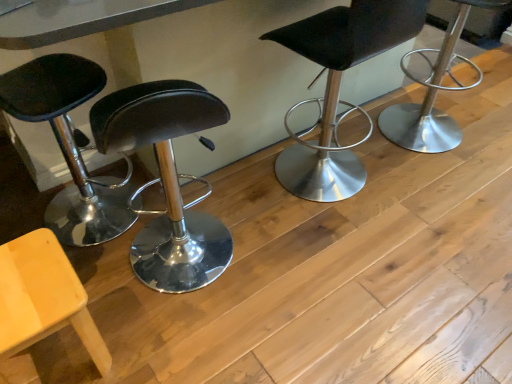
At what (x,y) coordinates should I click in order to perform the action: click on matte black stool at left, arranged as the fourth chair when viewed from the right. Please return your answer as a coordinate pair (x, y). Looking at the image, I should click on (69, 145).

What do you see at coordinates (42, 297) in the screenshot? I see `matte yellow chair at lower left, which ranks as the third chair in right-to-left order` at bounding box center [42, 297].

In order to click on polished silver stool at right, the 4th chair in the left-to-right sequence in this screenshot , I will do `click(433, 94)`.

From the picture: In order to face black leather stool at center, the 3th chair in the left-to-right sequence, should I rotate leftwards or rightwards?

Rotate right and turn 10.837 degrees.

Identify the location of matte black stool at left, arranged as the fourth chair when viewed from the right. The height and width of the screenshot is (384, 512). (69, 145).

Considering the positions of objects polished silver stool at right, the first chair positioned from the right, and matte black stool at left, arranged as the fourth chair when viewed from the right, in the image provided, who is in front, polished silver stool at right, the first chair positioned from the right, or matte black stool at left, arranged as the fourth chair when viewed from the right,?

Positioned in front is matte black stool at left, arranged as the fourth chair when viewed from the right.

Is polished silver stool at right, the 4th chair in the left-to-right sequence, positioned beyond the bounds of matte black stool at left, which appears as the 1th chair when viewed from the left?

Absolutely, polished silver stool at right, the 4th chair in the left-to-right sequence, is external to matte black stool at left, which appears as the 1th chair when viewed from the left.

This screenshot has height=384, width=512. I want to click on the 2nd chair above the matte black stool at left, arranged as the fourth chair when viewed from the right (from the image's perspective), so click(x=433, y=94).

Based on the photo, is matte black stool at left, arranged as the fourth chair when viewed from the right, at the back of polished silver stool at right, the first chair positioned from the right?

No, polished silver stool at right, the first chair positioned from the right,'s orientation is not away from matte black stool at left, arranged as the fourth chair when viewed from the right.

How many degrees apart are the facing directions of black leather stool at center, positioned as the 2th chair in right-to-left order, and matte black stool at left, arranged as the fourth chair when viewed from the right?

The angle between the facing direction of black leather stool at center, positioned as the 2th chair in right-to-left order, and the facing direction of matte black stool at left, arranged as the fourth chair when viewed from the right, is 96.2 degrees.

Could you tell me if black leather stool at center, the 3th chair in the left-to-right sequence, is facing matte black stool at left, which appears as the 1th chair when viewed from the left?

No, black leather stool at center, the 3th chair in the left-to-right sequence, is not facing towards matte black stool at left, which appears as the 1th chair when viewed from the left.

Is black leather stool at center, positioned as the 2th chair in right-to-left order, to the left of matte black stool at left, which appears as the 1th chair when viewed from the left, from the viewer's perspective?

Incorrect, black leather stool at center, positioned as the 2th chair in right-to-left order, is not on the left side of matte black stool at left, which appears as the 1th chair when viewed from the left.

Is black leather stool at center, the 3th chair in the left-to-right sequence, next to matte black stool at left, which appears as the 1th chair when viewed from the left, and touching it?

No, black leather stool at center, the 3th chair in the left-to-right sequence, is not making contact with matte black stool at left, which appears as the 1th chair when viewed from the left.

Who is smaller, black leather stool at center, the 3th chair in the left-to-right sequence, or matte yellow chair at lower left, which ranks as the third chair in right-to-left order?

With smaller size is matte yellow chair at lower left, which ranks as the third chair in right-to-left order.

Starting from the black leather stool at center, positioned as the 2th chair in right-to-left order, which chair is the 1st one to the left? Please provide its 2D coordinates.

[(42, 297)]

Between point (347, 51) and point (109, 367), which one is positioned behind?

The point (347, 51) is farther.

Based on the photo, from a real-world perspective, is black leather stool at center, the 3th chair in the left-to-right sequence, on top of matte yellow chair at lower left, which ranks as the third chair in right-to-left order?

Yes, from a real-world perspective, black leather stool at center, the 3th chair in the left-to-right sequence, is over matte yellow chair at lower left, which ranks as the third chair in right-to-left order

Is polished silver stool at right, the first chair positioned from the right, facing towards matte yellow chair at lower left, which ranks as the third chair in right-to-left order?

No, polished silver stool at right, the first chair positioned from the right, is not oriented towards matte yellow chair at lower left, which ranks as the third chair in right-to-left order.

Between point (428, 96) and point (86, 324), which one is positioned behind?

The point (428, 96) is more distant.

Is polished silver stool at right, the 4th chair in the left-to-right sequence, far away from matte yellow chair at lower left, which ranks as the third chair in right-to-left order?

Indeed, polished silver stool at right, the 4th chair in the left-to-right sequence, is not near matte yellow chair at lower left, which ranks as the third chair in right-to-left order.

Can you confirm if polished silver stool at right, the 4th chair in the left-to-right sequence, is smaller than matte yellow chair at lower left, the 2th chair in the left-to-right sequence?

No, polished silver stool at right, the 4th chair in the left-to-right sequence, is not smaller than matte yellow chair at lower left, the 2th chair in the left-to-right sequence.

Where is `the 2nd chair in front of the black leather stool at center, positioned as the 2th chair in right-to-left order`? the 2nd chair in front of the black leather stool at center, positioned as the 2th chair in right-to-left order is located at coordinates (42, 297).

Is matte yellow chair at lower left, the 2th chair in the left-to-right sequence, inside or outside of black leather stool at center, positioned as the 2th chair in right-to-left order?

matte yellow chair at lower left, the 2th chair in the left-to-right sequence, is outside black leather stool at center, positioned as the 2th chair in right-to-left order.

Based on their sizes in the image, would you say matte yellow chair at lower left, which ranks as the third chair in right-to-left order, is bigger or smaller than black leather stool at center, positioned as the 2th chair in right-to-left order?

In the image, matte yellow chair at lower left, which ranks as the third chair in right-to-left order, appears to be smaller than black leather stool at center, positioned as the 2th chair in right-to-left order.

Is matte yellow chair at lower left, which ranks as the third chair in right-to-left order, beside matte black stool at left, which appears as the 1th chair when viewed from the left?

matte yellow chair at lower left, which ranks as the third chair in right-to-left order, and matte black stool at left, which appears as the 1th chair when viewed from the left, are not in contact.

Image resolution: width=512 pixels, height=384 pixels. I want to click on chair below the matte black stool at left, arranged as the fourth chair when viewed from the right (from a real-world perspective), so click(42, 297).

From the image's perspective, is matte yellow chair at lower left, the 2th chair in the left-to-right sequence, located above or below matte black stool at left, which appears as the 1th chair when viewed from the left?

matte yellow chair at lower left, the 2th chair in the left-to-right sequence, is below matte black stool at left, which appears as the 1th chair when viewed from the left.

Which of these two, matte yellow chair at lower left, which ranks as the third chair in right-to-left order, or matte black stool at left, which appears as the 1th chair when viewed from the left, stands taller?

With more height is matte black stool at left, which appears as the 1th chair when viewed from the left.

Considering the relative sizes of polished silver stool at right, the 4th chair in the left-to-right sequence, and black leather stool at center, the 3th chair in the left-to-right sequence, in the image provided, is polished silver stool at right, the 4th chair in the left-to-right sequence, thinner than black leather stool at center, the 3th chair in the left-to-right sequence,?

Incorrect, the width of polished silver stool at right, the 4th chair in the left-to-right sequence, is not less than that of black leather stool at center, the 3th chair in the left-to-right sequence.

Is polished silver stool at right, the first chair positioned from the right, turned away from black leather stool at center, the 3th chair in the left-to-right sequence?

polished silver stool at right, the first chair positioned from the right, is not turned away from black leather stool at center, the 3th chair in the left-to-right sequence.

At what (x,y) coordinates should I click in order to perform the action: click on the 1st chair positioned below the black leather stool at center, the 3th chair in the left-to-right sequence (from a real-world perspective). Please return your answer as a coordinate pair (x, y). Looking at the image, I should click on (433, 94).

Considering the relative sizes of polished silver stool at right, the first chair positioned from the right, and black leather stool at center, positioned as the 2th chair in right-to-left order, in the image provided, is polished silver stool at right, the first chair positioned from the right, smaller than black leather stool at center, positioned as the 2th chair in right-to-left order,?

Indeed, polished silver stool at right, the first chair positioned from the right, has a smaller size compared to black leather stool at center, positioned as the 2th chair in right-to-left order.

The image size is (512, 384). I want to click on the 1st chair above the matte black stool at left, arranged as the fourth chair when viewed from the right (from a real-world perspective), so click(433, 94).

Starting from the black leather stool at center, the 3th chair in the left-to-right sequence, which chair is the 1st one in front? Please provide its 2D coordinates.

[(69, 145)]

Looking at this image, when comparing their distances from black leather stool at center, the 3th chair in the left-to-right sequence, does matte yellow chair at lower left, the 2th chair in the left-to-right sequence, or matte black stool at left, arranged as the fourth chair when viewed from the right, seem closer?

matte black stool at left, arranged as the fourth chair when viewed from the right, is closer to black leather stool at center, the 3th chair in the left-to-right sequence.

Considering their positions, is matte black stool at left, arranged as the fourth chair when viewed from the right, positioned further to polished silver stool at right, the 4th chair in the left-to-right sequence, than matte yellow chair at lower left, the 2th chair in the left-to-right sequence?

Based on the image, matte yellow chair at lower left, the 2th chair in the left-to-right sequence, appears to be further to polished silver stool at right, the 4th chair in the left-to-right sequence.

Looking at the image, which one is located further to matte yellow chair at lower left, the 2th chair in the left-to-right sequence, black leather stool at center, the 3th chair in the left-to-right sequence, or polished silver stool at right, the first chair positioned from the right?

Among the two, polished silver stool at right, the first chair positioned from the right, is located further to matte yellow chair at lower left, the 2th chair in the left-to-right sequence.

From the image, which object appears to be farther from polished silver stool at right, the 4th chair in the left-to-right sequence, matte yellow chair at lower left, the 2th chair in the left-to-right sequence, or black leather stool at center, the 3th chair in the left-to-right sequence?

matte yellow chair at lower left, the 2th chair in the left-to-right sequence, is positioned further to the anchor polished silver stool at right, the 4th chair in the left-to-right sequence.

Based on their spatial positions, is black leather stool at center, the 3th chair in the left-to-right sequence, or matte yellow chair at lower left, the 2th chair in the left-to-right sequence, closer to matte black stool at left, which appears as the 1th chair when viewed from the left?

Among the two, matte yellow chair at lower left, the 2th chair in the left-to-right sequence, is located nearer to matte black stool at left, which appears as the 1th chair when viewed from the left.

Looking at the image, which one is located further to black leather stool at center, the 3th chair in the left-to-right sequence, polished silver stool at right, the first chair positioned from the right, or matte black stool at left, which appears as the 1th chair when viewed from the left?

matte black stool at left, which appears as the 1th chair when viewed from the left.

Looking at the image, which one is located further to polished silver stool at right, the first chair positioned from the right, black leather stool at center, positioned as the 2th chair in right-to-left order, or matte black stool at left, arranged as the fourth chair when viewed from the right?

matte black stool at left, arranged as the fourth chair when viewed from the right, is positioned further to the anchor polished silver stool at right, the first chair positioned from the right.

Considering their positions, is matte black stool at left, arranged as the fourth chair when viewed from the right, positioned further to matte yellow chair at lower left, which ranks as the third chair in right-to-left order, than black leather stool at center, positioned as the 2th chair in right-to-left order?

Among the two, black leather stool at center, positioned as the 2th chair in right-to-left order, is located further to matte yellow chair at lower left, which ranks as the third chair in right-to-left order.

Identify the location of chair situated between matte yellow chair at lower left, which ranks as the third chair in right-to-left order, and polished silver stool at right, the first chair positioned from the right, from left to right. (x=339, y=86).

Identify the location of chair between matte black stool at left, arranged as the fourth chair when viewed from the right, and black leather stool at center, the 3th chair in the left-to-right sequence. (42, 297).